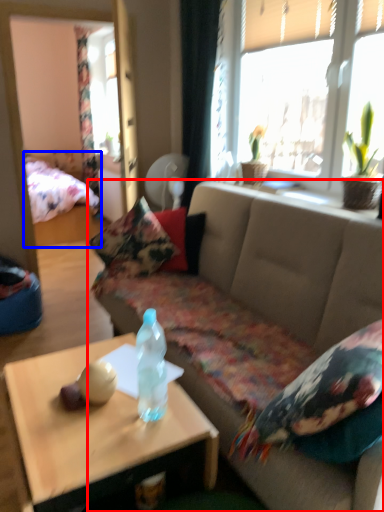
Question: Which object is closer to the camera taking this photo, studio couch (highlighted by a red box) or bed (highlighted by a blue box)?

Choices:
 (A) studio couch
 (B) bed

Answer: (A)